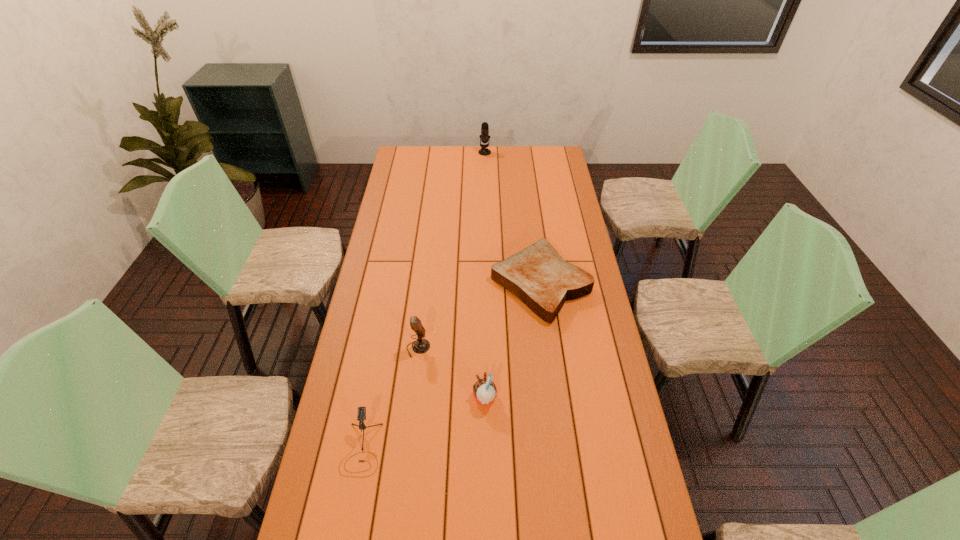
This screenshot has width=960, height=540. Identify the location of the farthest object. (484, 137).

Image resolution: width=960 pixels, height=540 pixels. Identify the location of the farthest microphone. (484, 137).

Locate an element on the screen. The width and height of the screenshot is (960, 540). the second nearest microphone is located at coordinates (421, 345).

Identify the location of the second object from left to right. The width and height of the screenshot is (960, 540). (421, 345).

Where is `the second nearest object`? The height and width of the screenshot is (540, 960). the second nearest object is located at coordinates (484, 390).

Where is `the nearest microphone`? the nearest microphone is located at coordinates (361, 415).

Locate an element on the screen. The width and height of the screenshot is (960, 540). the leftmost object is located at coordinates (361, 415).

The width and height of the screenshot is (960, 540). Identify the location of the fourth nearest object. (537, 275).

Locate an element on the screen. The height and width of the screenshot is (540, 960). the shortest object is located at coordinates click(537, 275).

The image size is (960, 540). I want to click on vacant area situated 0.340m on the front of the farthest microphone, so [485, 192].